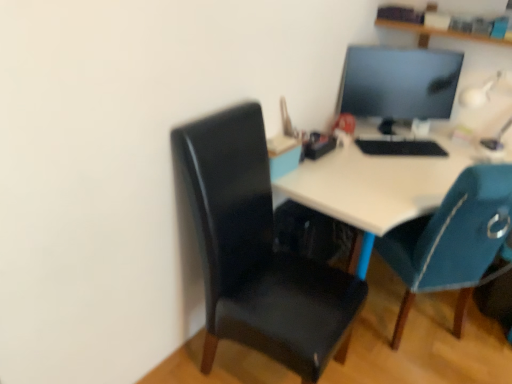
You are a GUI agent. You are given a task and a screenshot of the screen. Output one action in this format:
    pyautogui.click(x=<x>, y=<y>)
    Task: Click on the free space above white glossy desk at center (from a real-world perspective)
    This screenshot has width=512, height=384.
    Given the screenshot: What is the action you would take?
    [407, 177]